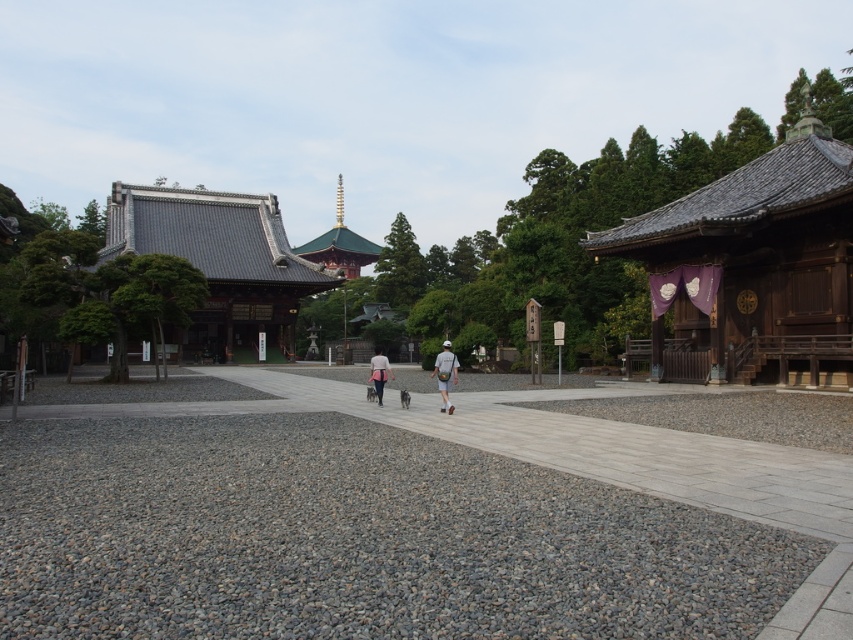
Question: In this image, where is matte gray dog at center located relative to light gray fabric bag at center?

Choices:
 (A) below
 (B) above

Answer: (B)

Question: Does gray gravel at lower left have a lesser width compared to gray gravel path at center?

Choices:
 (A) no
 (B) yes

Answer: (B)

Question: Which of the following is the farthest from the observer?

Choices:
 (A) light gray fabric bag at center
 (B) gray gravel path at center
 (C) gray gravel at lower left

Answer: (A)

Question: Which point is closer to the camera taking this photo?

Choices:
 (A) (381, 371)
 (B) (386, 358)

Answer: (B)

Question: Which point is farther to the camera?

Choices:
 (A) matte gray dog at center
 (B) gray gravel at lower left

Answer: (A)

Question: Is gray gravel at lower left above light gray fabric backpack at center?

Choices:
 (A) yes
 (B) no

Answer: (B)